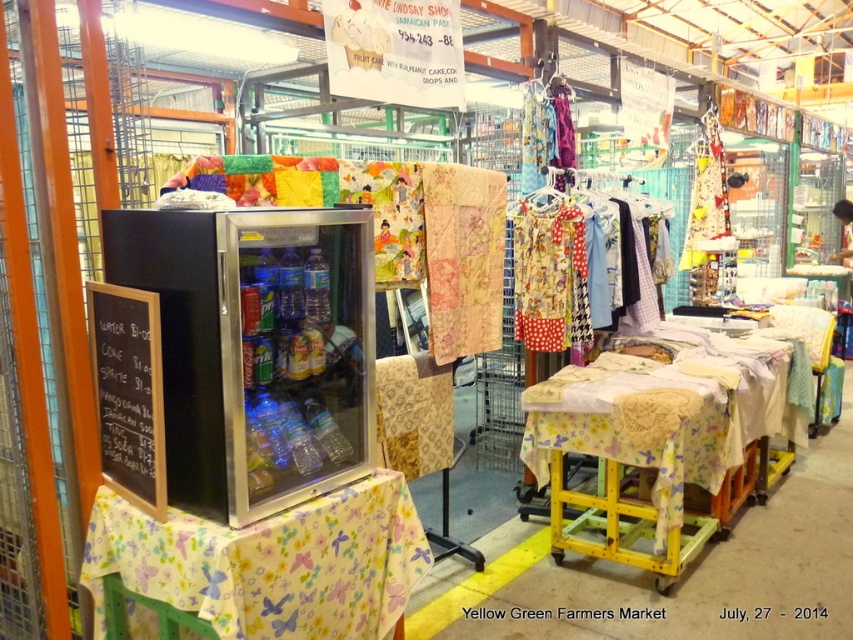
Which is more to the left, butterfly-patterned fabric at lower left or polka dot fabric dress at center?

From the viewer's perspective, butterfly-patterned fabric at lower left appears more on the left side.

Can you confirm if butterfly-patterned fabric at lower left is positioned to the left of polka dot fabric dress at center?

Yes, butterfly-patterned fabric at lower left is to the left of polka dot fabric dress at center.

Is point (360, 496) in front of point (518, 227)?

Yes, it is in front of point (518, 227).

Locate an element on the screen. This screenshot has height=640, width=853. butterfly-patterned fabric at lower left is located at coordinates (270, 563).

Does patchwork fabric at center have a smaller size compared to polka dot fabric dress at center?

Indeed, patchwork fabric at center has a smaller size compared to polka dot fabric dress at center.

Is point (500, 323) positioned before point (570, 337)?

Yes.

Is point (454, 204) closer to viewer compared to point (538, 234)?

Yes, it is in front of point (538, 234).

Locate an element on the screen. patchwork fabric at center is located at coordinates (463, 257).

Can you confirm if patchwork fabric at center is wider than black chalkboard at left?

Yes.

Identify the location of patchwork fabric at center. (463, 257).

In order to click on patchwork fabric at center in this screenshot , I will do (463, 257).

In order to click on patchwork fabric at center in this screenshot , I will do `click(463, 257)`.